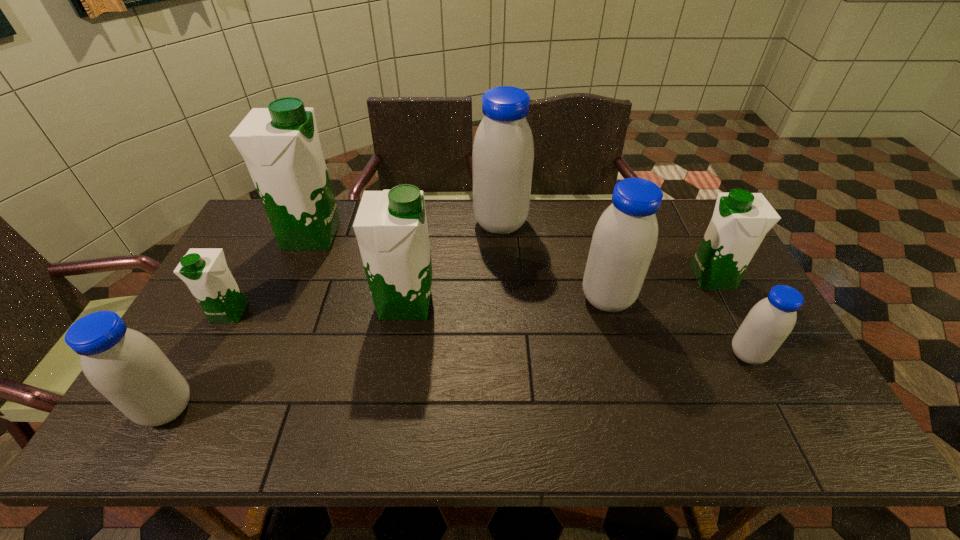
This screenshot has width=960, height=540. Find the location of `the smallest green soya milk`. the smallest green soya milk is located at coordinates [x=205, y=272].

You are a GUI agent. You are given a task and a screenshot of the screen. Output one action in this format:
    pyautogui.click(x=<x>, y=<y>)
    Task: Click on the seventh farthest object
    The height and width of the screenshot is (540, 960).
    Given the screenshot: What is the action you would take?
    pyautogui.click(x=770, y=321)

I want to click on the third farthest blue soya milk, so click(770, 321).

The height and width of the screenshot is (540, 960). I want to click on free location located 0.120m on the front-facing side of the farthest green soya milk, so click(x=377, y=235).

Identify the location of free space located 0.260m on the right of the farthest blue soya milk. (603, 224).

You are a GUI agent. You are given a task and a screenshot of the screen. Output one action in this format:
    pyautogui.click(x=<x>, y=<y>)
    Task: Click on the blank space located 0.300m on the front-facing side of the third smallest green soya milk
    This screenshot has width=960, height=540.
    Given the screenshot: What is the action you would take?
    pyautogui.click(x=540, y=303)

Find the location of `vacant position located 0.110m on the left of the sixth object from left to right`. vacant position located 0.110m on the left of the sixth object from left to right is located at coordinates (541, 299).

What are the coordinates of `blank area located 0.350m on the front-facing side of the third biggest green soya milk` in the screenshot? It's located at (574, 278).

This screenshot has width=960, height=540. In order to click on vacant space positioned on the front-facing side of the third biggest green soya milk in this screenshot , I will do `click(674, 278)`.

Where is `vacant space situated on the front-facing side of the third biggest green soya milk`? This screenshot has height=540, width=960. vacant space situated on the front-facing side of the third biggest green soya milk is located at coordinates tap(588, 278).